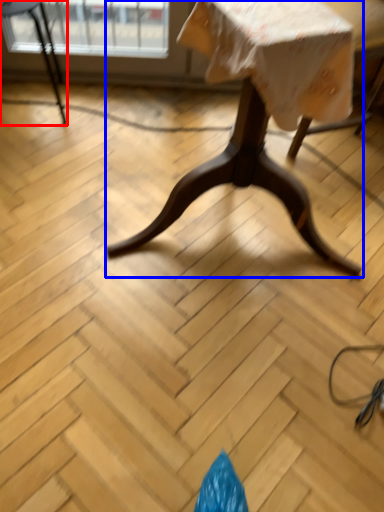
Question: Among these objects, which one is nearest to the camera, chair (highlighted by a red box) or table (highlighted by a blue box)?

Choices:
 (A) chair
 (B) table

Answer: (B)